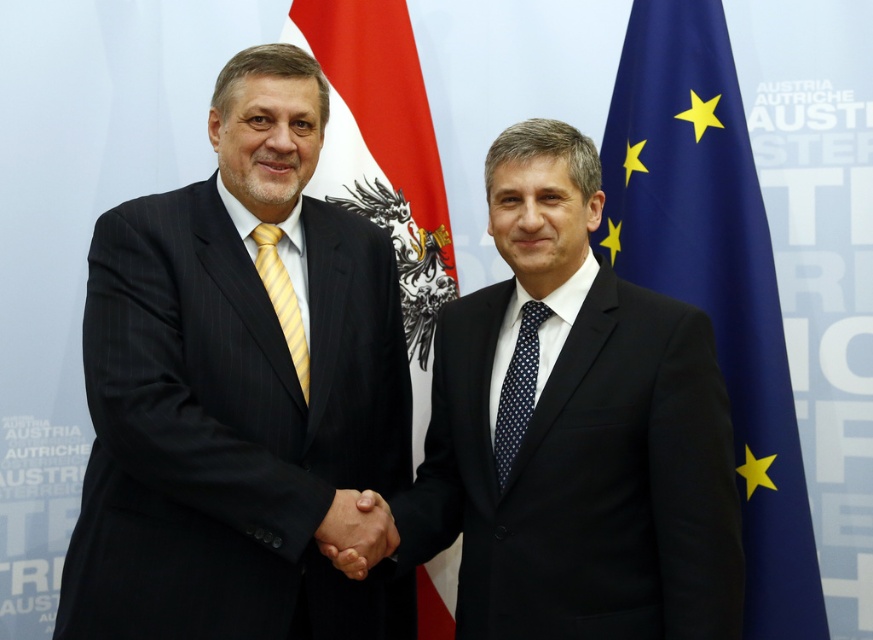
Question: Estimate the real-world distances between objects in this image. Which object is farther from the yellow striped tie at left?

Choices:
 (A) black matte hand at center
 (B) black matte suit at center

Answer: (B)

Question: Is matte black suit at left thinner than black matte suit at center?

Choices:
 (A) yes
 (B) no

Answer: (B)

Question: Is black matte suit at center smaller than black matte hand at center?

Choices:
 (A) yes
 (B) no

Answer: (B)

Question: Does black matte hand at center appear under yellow striped tie at left?

Choices:
 (A) yes
 (B) no

Answer: (A)

Question: Based on their relative distances, which object is nearer to the red fabric flag at left?

Choices:
 (A) blue dotted tie at center
 (B) black matte hand at center
 (C) black matte suit at center
 (D) blue fabric flag at right

Answer: (C)

Question: Which of these objects is positioned farthest from the yellow striped tie at left?

Choices:
 (A) blue fabric flag at right
 (B) black matte hand at center
 (C) black matte suit at center

Answer: (A)